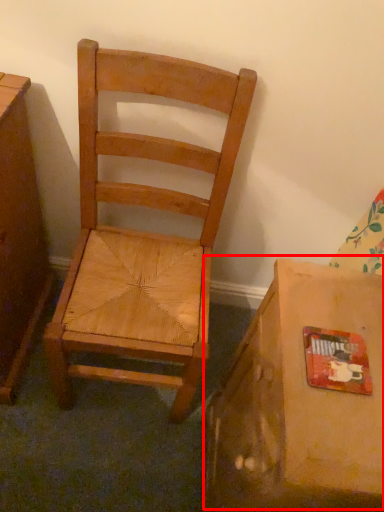
Question: From the image's perspective, what is the correct spatial positioning of cardboard box (annotated by the red box) in reference to chair?

Choices:
 (A) above
 (B) below

Answer: (B)